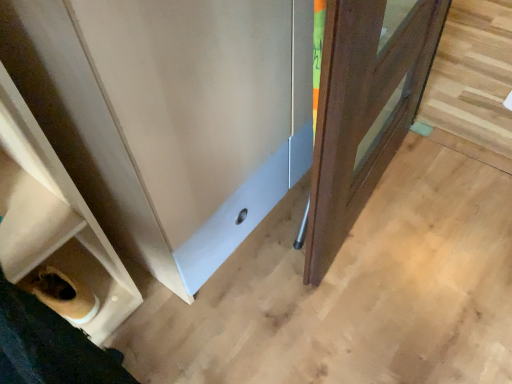
Question: Does wooden door at right come behind white matte shelf at lower left?

Choices:
 (A) no
 (B) yes

Answer: (B)

Question: Is wooden door at right positioned in front of white matte shelf at lower left?

Choices:
 (A) yes
 (B) no

Answer: (B)

Question: Is wooden door at right at the left side of white matte shelf at lower left?

Choices:
 (A) no
 (B) yes

Answer: (A)

Question: From a real-world perspective, is wooden door at right located higher than white matte shelf at lower left?

Choices:
 (A) no
 (B) yes

Answer: (A)

Question: From the image's perspective, would you say wooden door at right is shown under white matte shelf at lower left?

Choices:
 (A) yes
 (B) no

Answer: (B)

Question: From a real-world perspective, is wooden door at right physically below white matte shelf at lower left?

Choices:
 (A) no
 (B) yes

Answer: (B)

Question: Can you confirm if white matte shelf at lower left is thinner than wooden door at right?

Choices:
 (A) yes
 (B) no

Answer: (A)

Question: From the image's perspective, is white matte shelf at lower left below wooden door at right?

Choices:
 (A) no
 (B) yes

Answer: (B)

Question: Is white matte shelf at lower left facing towards wooden door at right?

Choices:
 (A) no
 (B) yes

Answer: (A)

Question: Does white matte shelf at lower left have a larger size compared to wooden door at right?

Choices:
 (A) no
 (B) yes

Answer: (A)

Question: From a real-world perspective, is white matte shelf at lower left positioned under wooden door at right based on gravity?

Choices:
 (A) no
 (B) yes

Answer: (A)

Question: Is white matte shelf at lower left positioned behind wooden door at right?

Choices:
 (A) no
 (B) yes

Answer: (A)

Question: Considering the positions of wooden door at right and white matte shelf at lower left in the image, is wooden door at right wider or thinner than white matte shelf at lower left?

Choices:
 (A) thin
 (B) wide

Answer: (B)